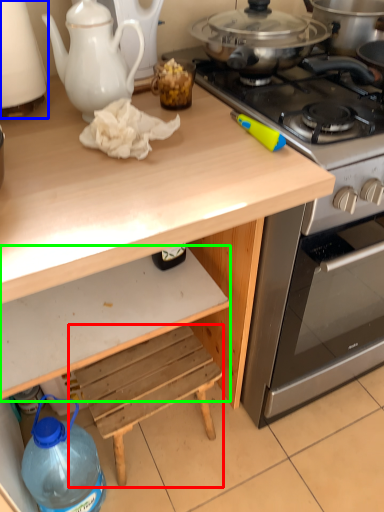
Question: Based on their relative distances, which object is nearer to step stool (highlighted by a red box)? Choose from kitchen appliance (highlighted by a blue box) and drawer (highlighted by a green box).

Choices:
 (A) kitchen appliance
 (B) drawer

Answer: (B)